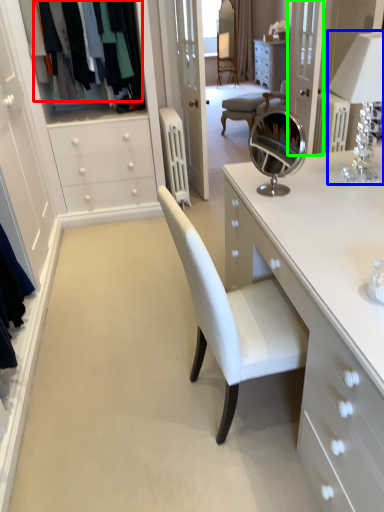
Question: Considering the real-world distances, which object is closest to clothing (highlighted by a red box)? table lamp (highlighted by a blue box) or glass door (highlighted by a green box).

Choices:
 (A) table lamp
 (B) glass door

Answer: (B)